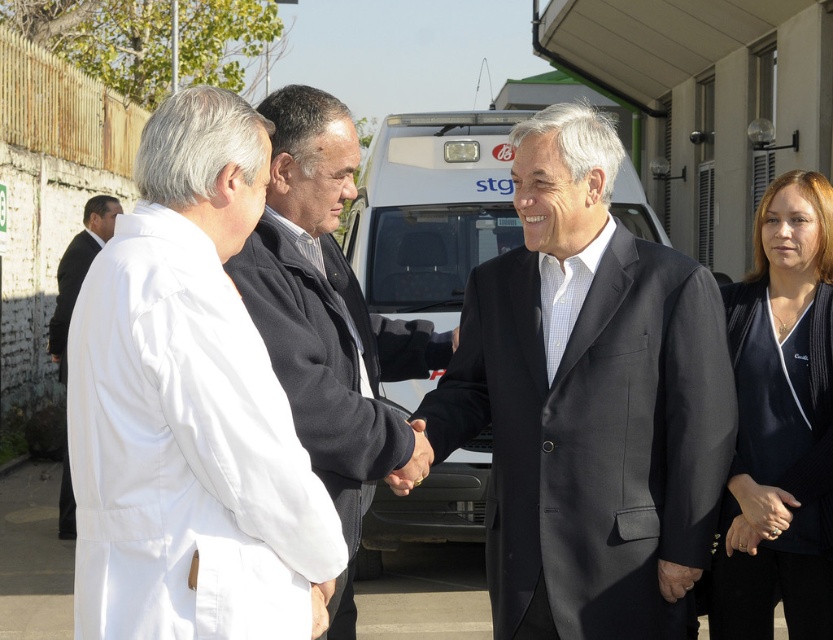
Question: Is dark blue textured blazer at right above white coat at left?

Choices:
 (A) yes
 (B) no

Answer: (B)

Question: Is dark blue textured blazer at right further to camera compared to white coat at left?

Choices:
 (A) no
 (B) yes

Answer: (A)

Question: Which object is farther from the camera taking this photo?

Choices:
 (A) white lab coat at left
 (B) white coat at left

Answer: (B)

Question: Which object is the closest to the dark gray sweater at center?

Choices:
 (A) matte black suit at center
 (B) white coat at left

Answer: (A)

Question: Among these points, which one is nearest to the camera?

Choices:
 (A) (60, 536)
 (B) (796, 627)

Answer: (B)

Question: Considering the relative positions of matte black suit at center and white lab coat at left in the image provided, where is matte black suit at center located with respect to white lab coat at left?

Choices:
 (A) above
 (B) below

Answer: (B)